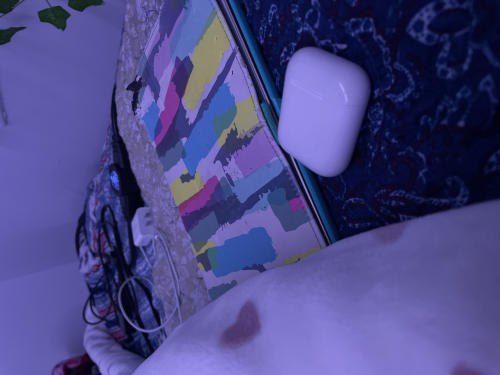
In order to click on ipad cover in this screenshot , I will do `click(206, 104)`.